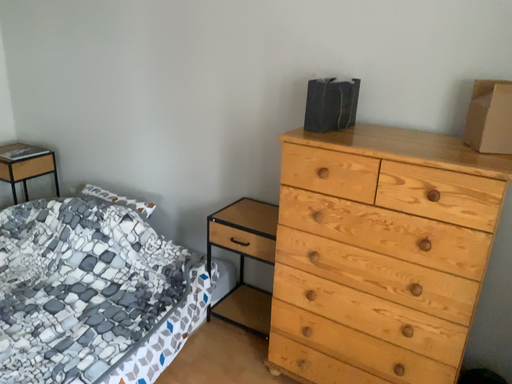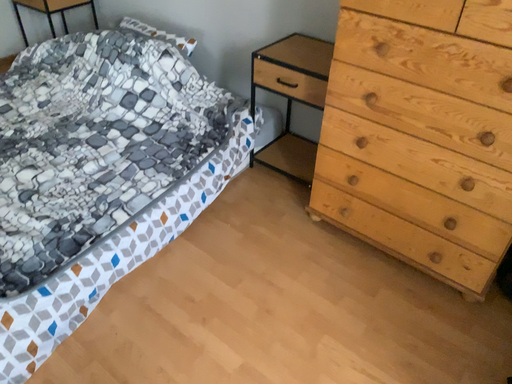
Question: How did the camera likely rotate when shooting the video?

Choices:
 (A) rotated left
 (B) rotated right

Answer: (A)